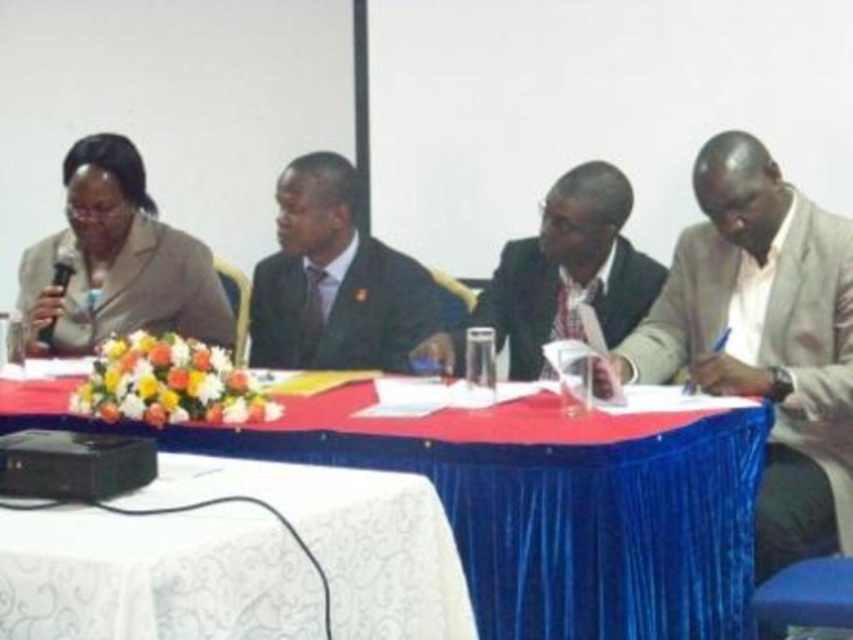
Is satin black suit at center positioned before black plastic microphone at left?

Yes, it is.

Who is taller, satin black suit at center or black plastic microphone at left?

With more height is satin black suit at center.

This screenshot has height=640, width=853. What are the coordinates of `satin black suit at center` in the screenshot? It's located at (335, 282).

Between blue fabric table at center and matte beige suit at left, which one is positioned higher?

matte beige suit at left is higher up.

Measure the distance between point (763, 417) and camera.

Point (763, 417) and camera are 2.29 meters apart from each other.

I want to click on blue fabric table at center, so click(531, 500).

Between matte beige suit at left and black plastic microphone at left, which one is positioned higher?

Positioned higher is matte beige suit at left.

Between matte beige suit at left and black plastic microphone at left, which one has less height?

black plastic microphone at left is shorter.

What do you see at coordinates (119, 260) in the screenshot? Image resolution: width=853 pixels, height=640 pixels. I see `matte beige suit at left` at bounding box center [119, 260].

Where is `matte beige suit at left`? The height and width of the screenshot is (640, 853). matte beige suit at left is located at coordinates (119, 260).